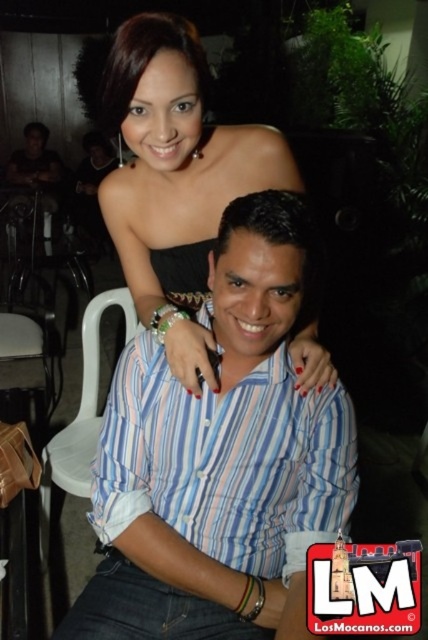
You are a photographer at a social event. You need to capture a photo of both the striped cotton shirt at center and the matte black dress at center. Which one should you focus on first if you want to ensure both are in frame without moving the camera?

The striped cotton shirt at center is shorter than the matte black dress at center, so you should focus on the striped cotton shirt at center first to ensure both are in frame without moving the camera.

You are taking a photo of the scene and want to focus on both the point at (x=229, y=524) and the point at (x=42, y=324). Which point should you adjust your focus to first to ensure both are in clear view?

You should focus on point (x=229, y=524) first because it is closer to the camera than point (x=42, y=324). By focusing on the closer point, the farther point will also be in focus if the depth of field is sufficient.